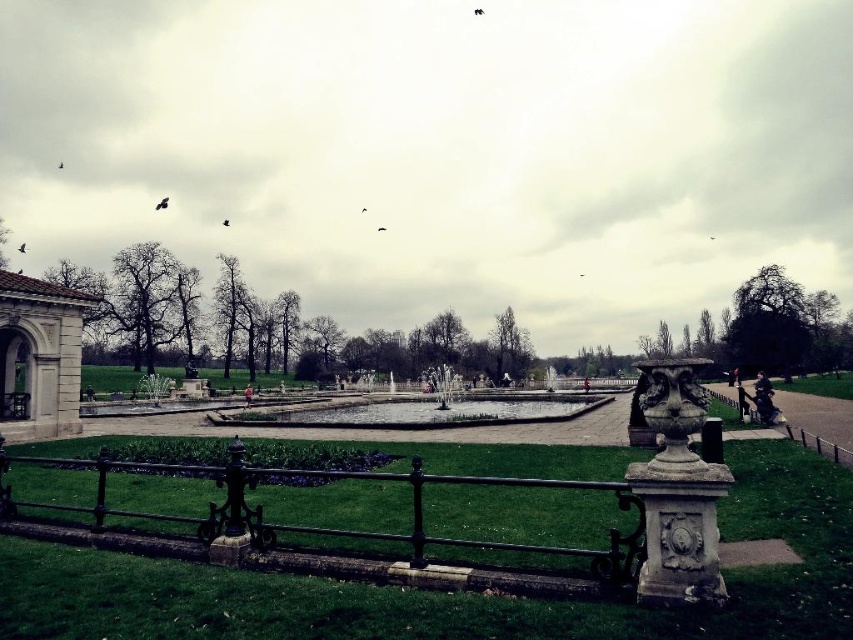
You are standing in the park and want to take a photo of the white stone arch at left without the black wrought iron fence at lower center blocking the view. Which direction should you move to ensure the arch is visible without the fence in the frame?

Move to the right side of the black wrought iron fence at lower center so that the white stone arch at left becomes visible without obstruction from the fence.

You are standing in the park and want to take a photo of the white stone arch at left and the clear glass pond at center. Which object should you focus on first if you want both to be in sharp focus?

You should focus on the white stone arch at left first because it is closer to the viewer than the clear glass pond at center. By focusing on the closer object, the farther object may still be in acceptable focus depending on the depth of field.

From the picture: You are a landscape architect designing a new park layout. You need to place a 3m wide flower bed between the black wrought iron fence at lower center and the clear glass pond at center. Is there enough space between them for this flower bed?

The black wrought iron fence at lower center is narrower than the clear glass pond at center. However, the description only provides information about their widths relative to each other, not the exact distance between them. Without knowing the actual spacing between the two objects, it is impossible to determine if there is sufficient room for a 3m wide flower bed.